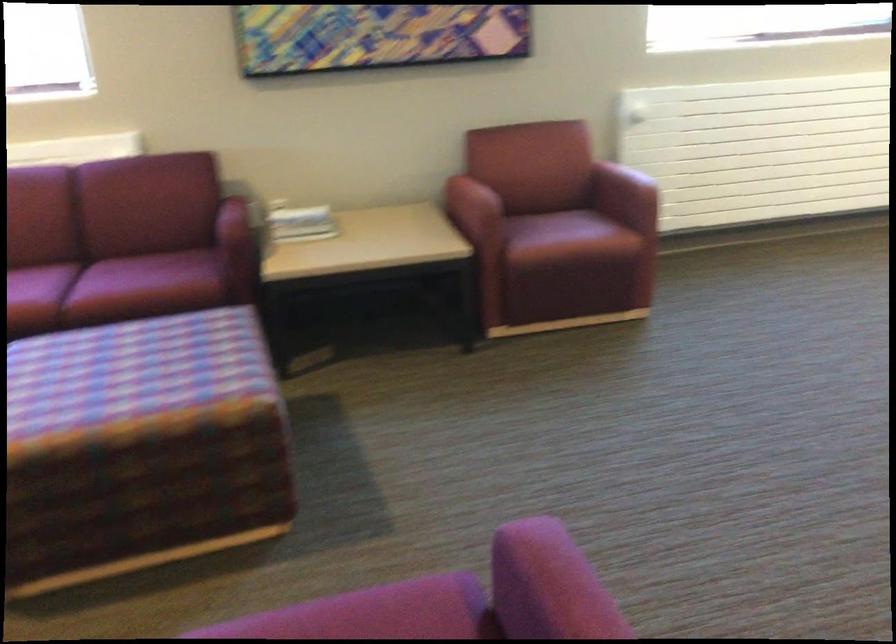
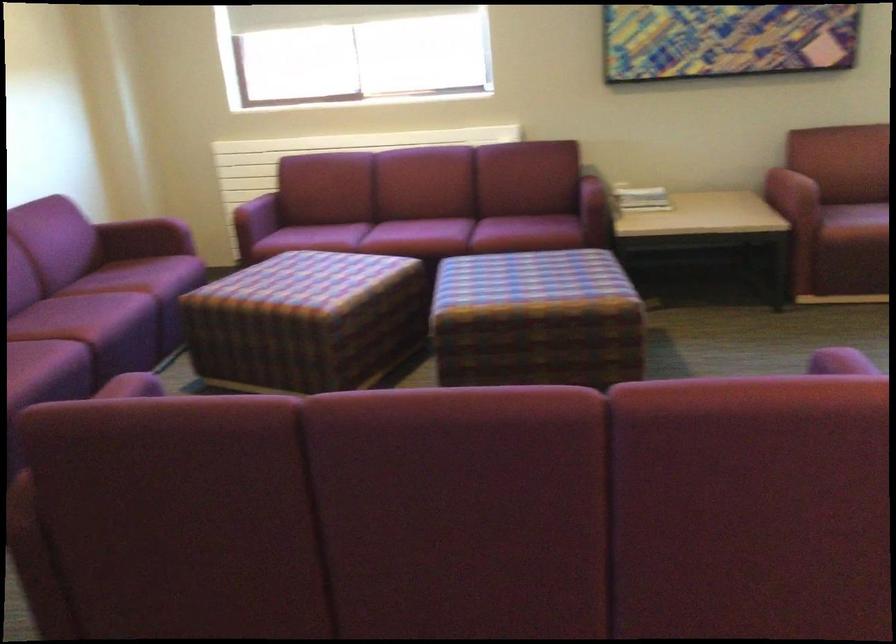
Question: The images are taken continuously from a first-person perspective. In which direction is your viewpoint rotating?

Choices:
 (A) Left
 (B) Right
 (C) Up
 (D) Down

Answer: (A)